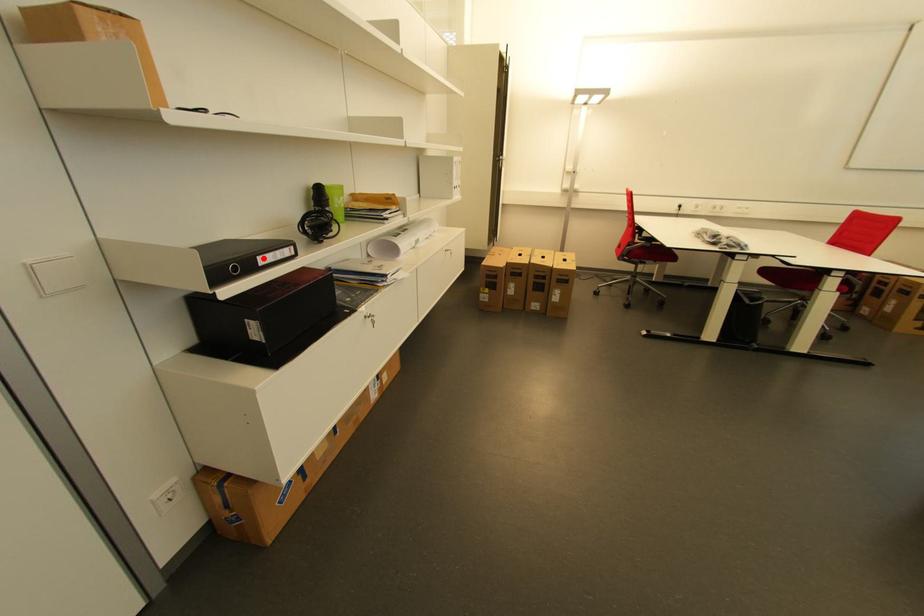
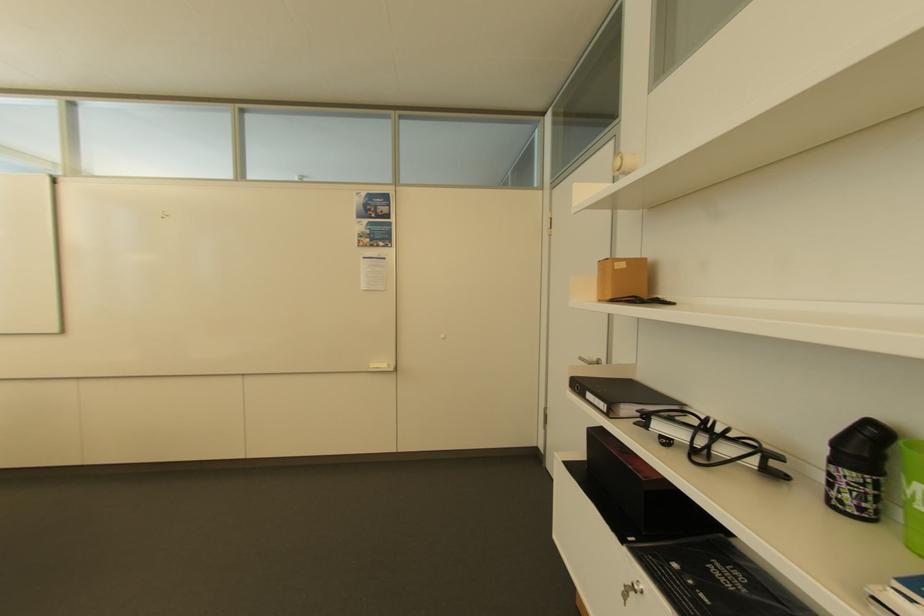
Locate, in the second image, the point that corresponds to the highlighted location in the first image.

(592, 392)